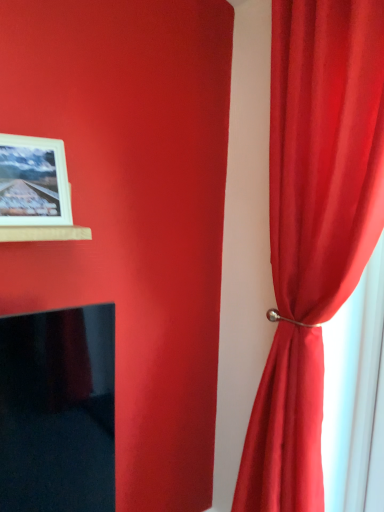
Question: Is white matte picture frame at upper left bigger or smaller than satin red curtain at right?

Choices:
 (A) small
 (B) big

Answer: (A)

Question: From the image's perspective, is white matte picture frame at upper left located above or below satin red curtain at right?

Choices:
 (A) below
 (B) above

Answer: (B)

Question: From their relative heights in the image, would you say white matte picture frame at upper left is taller or shorter than satin red curtain at right?

Choices:
 (A) tall
 (B) short

Answer: (B)

Question: Is point (317, 393) closer or farther from the camera than point (46, 146)?

Choices:
 (A) farther
 (B) closer

Answer: (A)

Question: From a real-world perspective, is satin red curtain at right physically located above or below white matte picture frame at upper left?

Choices:
 (A) below
 (B) above

Answer: (A)

Question: In terms of size, does satin red curtain at right appear bigger or smaller than white matte picture frame at upper left?

Choices:
 (A) big
 (B) small

Answer: (A)

Question: From the image's perspective, is satin red curtain at right above or below white matte picture frame at upper left?

Choices:
 (A) below
 (B) above

Answer: (A)